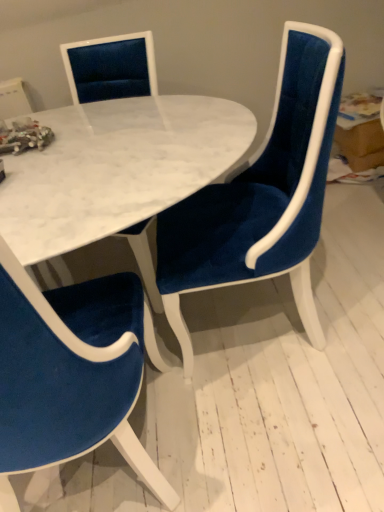
Locate an element on the screen. Image resolution: width=384 pixels, height=512 pixels. vacant area that is situated to the right of velvet blue chair at center, the 1th chair viewed from the right is located at coordinates (352, 267).